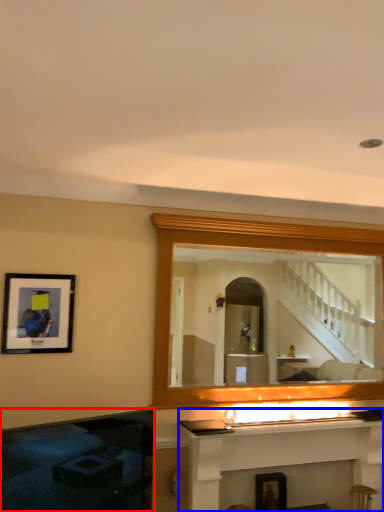
Question: Among these objects, which one is nearest to the camera, fireplace (highlighted by a red box) or fireplace (highlighted by a blue box)?

Choices:
 (A) fireplace
 (B) fireplace

Answer: (A)